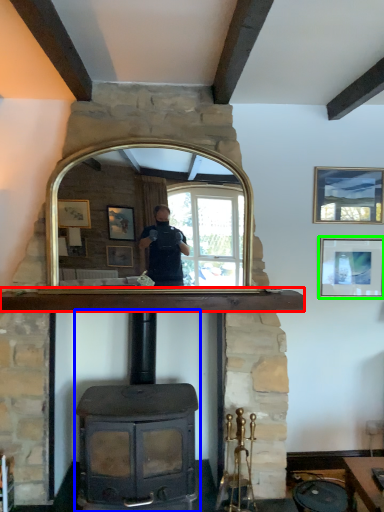
Question: Estimate the real-world distances between objects in this image. Which object is farther from mantle (highlighted by a red box), wood burning stove (highlighted by a blue box) or picture frame (highlighted by a green box)?

Choices:
 (A) wood burning stove
 (B) picture frame

Answer: (B)